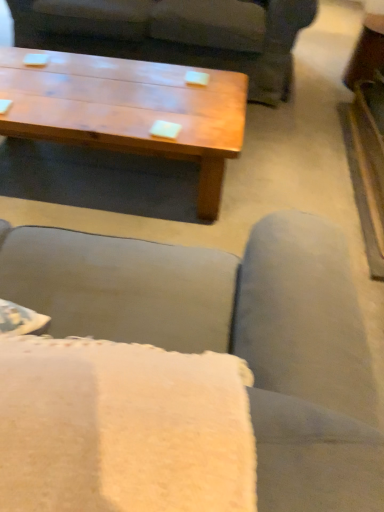
Question: Considering the positions of wooden coffee table at upper center and matte gray couch at center in the image, is wooden coffee table at upper center taller or shorter than matte gray couch at center?

Choices:
 (A) tall
 (B) short

Answer: (B)

Question: Considering the positions of point (82, 56) and point (119, 15), is point (82, 56) closer or farther from the camera than point (119, 15)?

Choices:
 (A) closer
 (B) farther

Answer: (A)

Question: From the image's perspective, is wooden coffee table at upper center located above or below matte gray couch at center?

Choices:
 (A) below
 (B) above

Answer: (A)

Question: Is matte gray couch at center bigger or smaller than wooden coffee table at upper center?

Choices:
 (A) big
 (B) small

Answer: (A)

Question: Relative to wooden coffee table at upper center, is matte gray couch at center in front or behind?

Choices:
 (A) behind
 (B) front

Answer: (A)

Question: From the image's perspective, relative to wooden coffee table at upper center, is matte gray couch at center above or below?

Choices:
 (A) above
 (B) below

Answer: (A)

Question: From a real-world perspective, is matte gray couch at center positioned above or below wooden coffee table at upper center?

Choices:
 (A) above
 (B) below

Answer: (A)